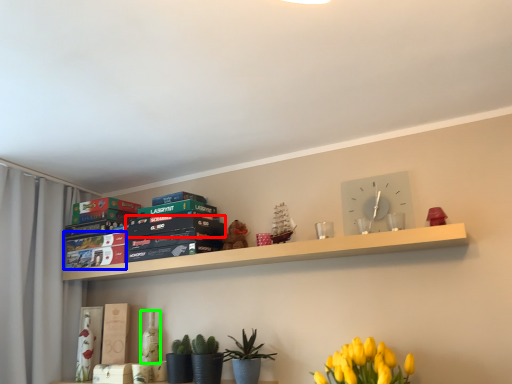
Question: Considering the real-world distances, which object is closest to paperback book (highlighted by a red box)? paperback book (highlighted by a blue box) or bottle (highlighted by a green box).

Choices:
 (A) paperback book
 (B) bottle

Answer: (A)